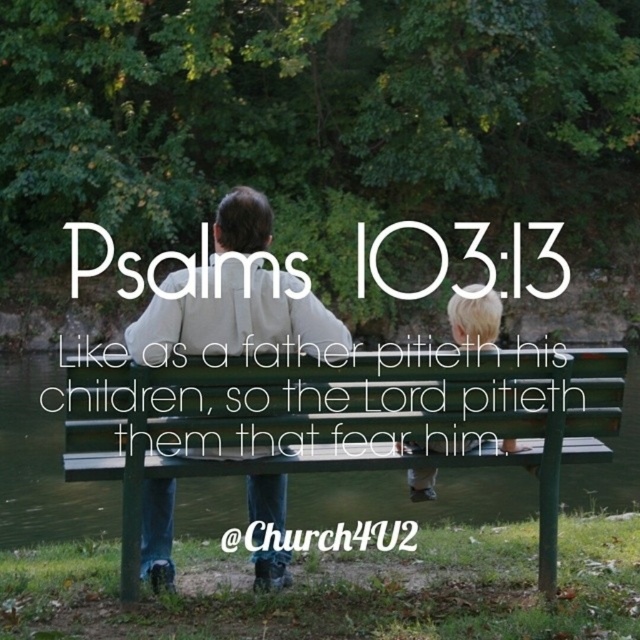
Question: Is the position of green wooden bench at center more distant than that of blonde hair at center?

Choices:
 (A) yes
 (B) no

Answer: (B)

Question: Which of the following is the farthest from the observer?

Choices:
 (A) white matte shirt at center
 (B) blonde hair at center
 (C) green wooden bench at center

Answer: (A)

Question: Which is nearer to the green wooden bench at center?

Choices:
 (A) white matte shirt at center
 (B) blonde hair at center

Answer: (A)

Question: From the image, what is the correct spatial relationship of green wooden bench at center in relation to blonde hair at center?

Choices:
 (A) left
 (B) right

Answer: (A)

Question: Is green wooden bench at center positioned behind blonde hair at center?

Choices:
 (A) yes
 (B) no

Answer: (B)

Question: Which is nearer to the white matte shirt at center?

Choices:
 (A) blonde hair at center
 (B) green wooden bench at center

Answer: (B)